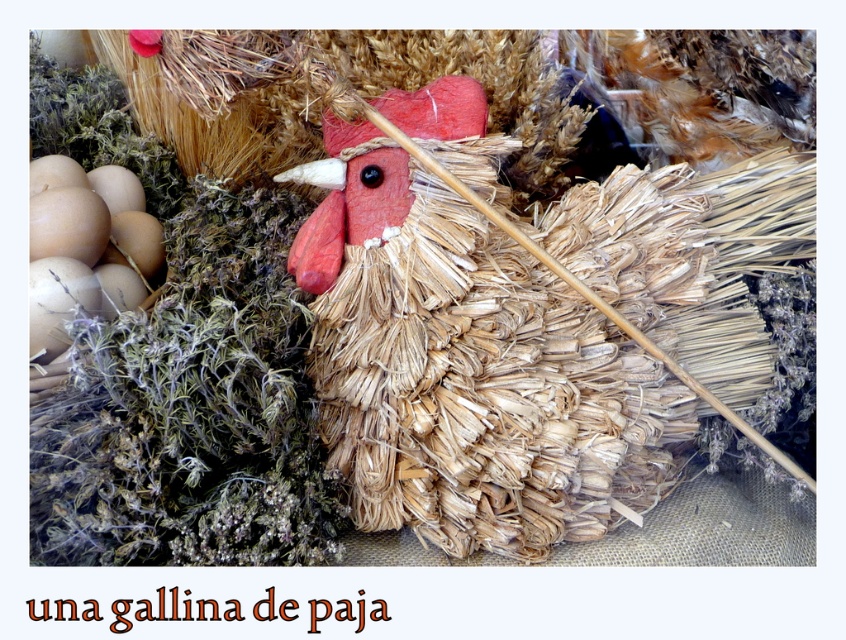
Question: Does straw-like textured chicken at center appear on the left side of brown matte eggs at left?

Choices:
 (A) yes
 (B) no

Answer: (B)

Question: Is straw-like textured chicken at center positioned behind brown matte eggs at left?

Choices:
 (A) no
 (B) yes

Answer: (A)

Question: Can you confirm if straw-like textured chicken at center is positioned to the right of brown matte eggs at left?

Choices:
 (A) yes
 (B) no

Answer: (A)

Question: Which of the following is the closest to the observer?

Choices:
 (A) (608, 467)
 (B) (58, 208)

Answer: (A)